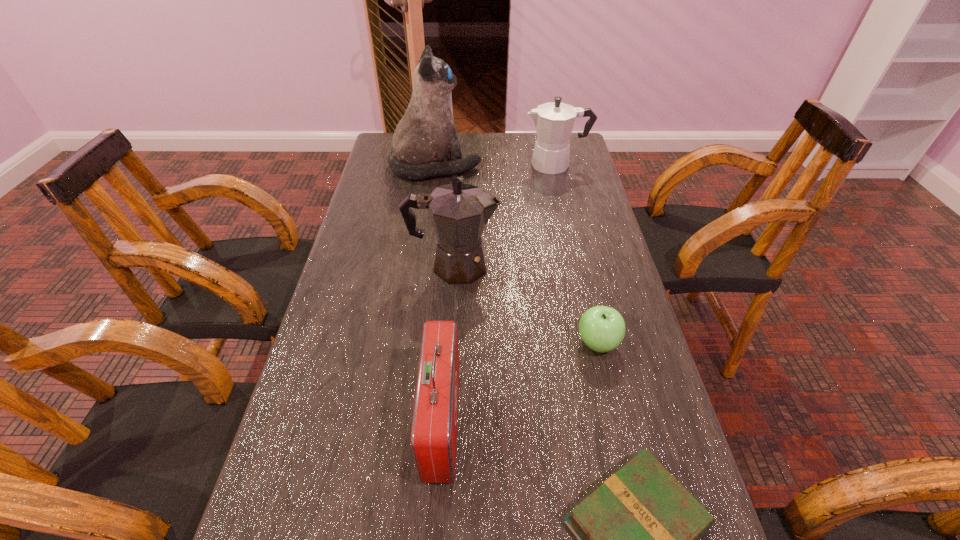
The height and width of the screenshot is (540, 960). Find the location of `cat`. cat is located at coordinates (425, 136).

Identify the location of the nearer coffeepot. The width and height of the screenshot is (960, 540). (459, 212).

Locate an element on the screen. Image resolution: width=960 pixels, height=540 pixels. the third farthest object is located at coordinates (459, 212).

The height and width of the screenshot is (540, 960). Identify the location of the farther coffeepot. (554, 121).

I want to click on the first-aid kit, so click(433, 440).

The image size is (960, 540). Find the location of `apple`. apple is located at coordinates (602, 328).

Identify the location of the third nearest object. (602, 328).

Where is `vacant region located at the face of the cat`? vacant region located at the face of the cat is located at coordinates (559, 166).

Locate an element on the screen. The height and width of the screenshot is (540, 960). vacant space located on the pouring side of the nearer coffeepot is located at coordinates (567, 266).

You are a GUI agent. You are given a task and a screenshot of the screen. Output one action in this format:
    pyautogui.click(x=<x>, y=<y>)
    Task: Click on the vacant region located at the spout of the right coffeepot
    This screenshot has height=540, width=960.
    Given the screenshot: What is the action you would take?
    pyautogui.click(x=478, y=165)